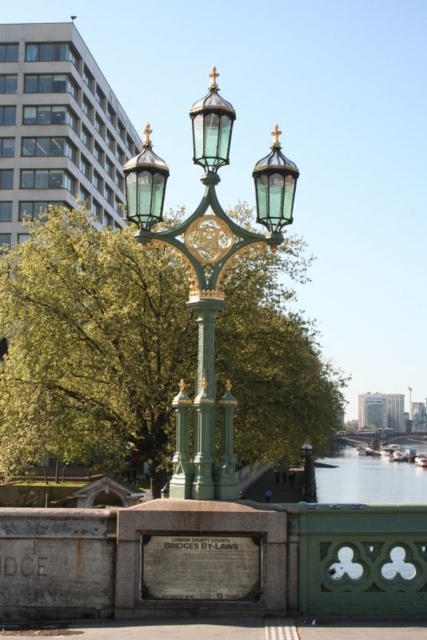
Between green leafy tree at center and green glass street light at center, which one has less height?

With less height is green glass street light at center.

Between point (251, 321) and point (306, 486), which one is positioned behind?

The point (306, 486) is more distant.

Image resolution: width=427 pixels, height=640 pixels. What are the coordinates of `green leafy tree at center` in the screenshot? It's located at (90, 348).

This screenshot has width=427, height=640. Describe the element at coordinates (90, 348) in the screenshot. I see `green leafy tree at center` at that location.

Which is in front, point (277, 352) or point (342, 458)?

Point (277, 352) is in front.

I want to click on green leafy tree at center, so click(x=90, y=348).

Can you confirm if clear water at lower right is smaller than green glass street light at center?

Actually, clear water at lower right might be larger than green glass street light at center.

Which is above, clear water at lower right or green glass street light at center?

Positioned higher is green glass street light at center.

Where is `clear water at lower right`? clear water at lower right is located at coordinates (368, 480).

Locate an element on the screen. The image size is (427, 640). clear water at lower right is located at coordinates (368, 480).